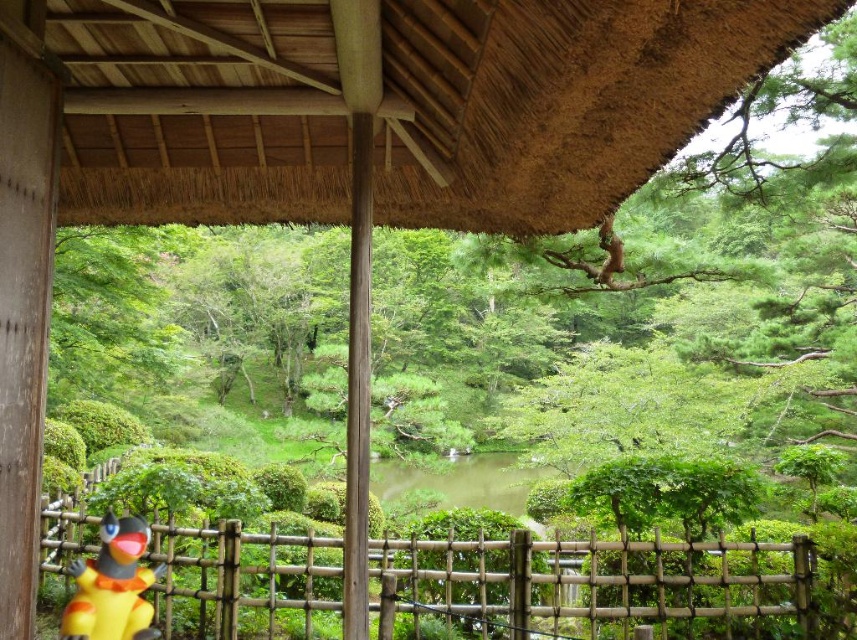
Does point (391, 560) come farther from viewer compared to point (130, 580)?

Yes, point (391, 560) is farther from viewer.

Does bamboo fence at lower center appear on the left side of yellow matte toy at lower left?

No, bamboo fence at lower center is not to the left of yellow matte toy at lower left.

Between point (277, 634) and point (129, 580), which one is positioned behind?

The point (277, 634) is behind.

Where is `bamboo fence at lower center`? This screenshot has width=857, height=640. bamboo fence at lower center is located at coordinates (597, 582).

Is thatched straw roof at upper center taller than yellow matte toy at lower left?

Yes.

You are a GUI agent. You are given a task and a screenshot of the screen. Output one action in this format:
    pyautogui.click(x=<x>, y=<y>)
    Task: Click on the thatched straw roof at upper center
    Image resolution: width=857 pixels, height=640 pixels.
    Given the screenshot: What is the action you would take?
    387,100

Can you confirm if thatched straw roof at upper center is positioned below bamboo fence at lower center?

Incorrect, thatched straw roof at upper center is not positioned below bamboo fence at lower center.

Is point (760, 3) farther from camera compared to point (705, 595)?

No, (760, 3) is in front of (705, 595).

The image size is (857, 640). Describe the element at coordinates (387, 100) in the screenshot. I see `thatched straw roof at upper center` at that location.

The image size is (857, 640). What are the coordinates of `thatched straw roof at upper center` in the screenshot? It's located at (387, 100).